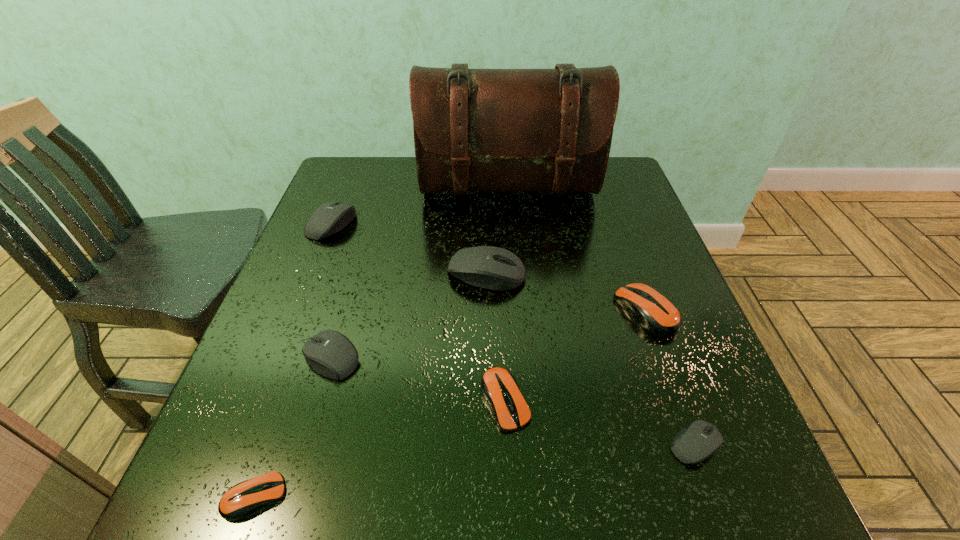
Locate an element on the screen. This screenshot has height=540, width=960. brown satchel is located at coordinates click(x=496, y=130).

This screenshot has height=540, width=960. I want to click on satchel, so click(496, 130).

What are the coordinates of `the second black computer equipment from right to left` in the screenshot? It's located at (489, 267).

Find the location of a particular element. the biggest black computer equipment is located at coordinates (489, 267).

Identify the location of the third smallest black computer equipment. The height and width of the screenshot is (540, 960). (331, 217).

I want to click on the sixth shortest object, so click(331, 217).

This screenshot has width=960, height=540. In order to click on the rightmost orange computer mouse in this screenshot , I will do `click(655, 313)`.

The image size is (960, 540). I want to click on the farthest orange computer mouse, so click(655, 313).

At what (x,y) coordinates should I click in order to perform the action: click on the third biggest black computer equipment. Please return your answer as a coordinate pair (x, y). Looking at the image, I should click on (331, 354).

What are the coordinates of `the second biggest orange computer mouse` in the screenshot? It's located at (500, 389).